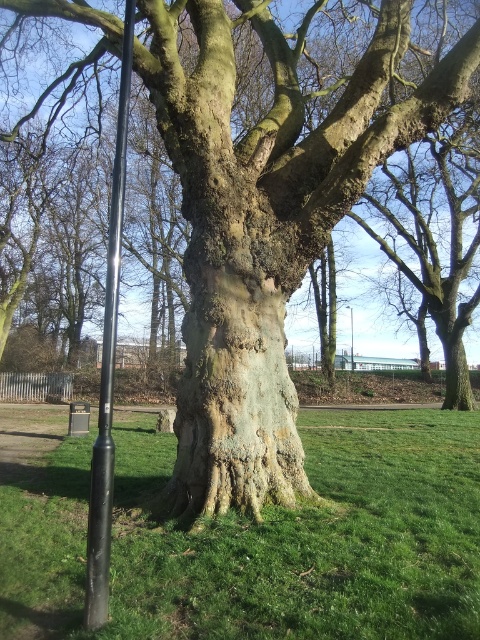
Question: Which of the following is the closest to the observer?

Choices:
 (A) (350, 355)
 (B) (98, 577)

Answer: (B)

Question: Which object is the farthest from the black metal pole at center?

Choices:
 (A) black matte pole at left
 (B) green grassy at center

Answer: (A)

Question: Is black matte pole at left positioned before black metal pole at center?

Choices:
 (A) yes
 (B) no

Answer: (A)

Question: Does green grassy at center appear under black metal pole at center?

Choices:
 (A) yes
 (B) no

Answer: (A)

Question: Which of the following is the farthest from the observer?

Choices:
 (A) green grassy at center
 (B) black metal pole at center
 (C) black matte pole at left

Answer: (B)

Question: Can you confirm if green grassy at center is bigger than black matte pole at left?

Choices:
 (A) yes
 (B) no

Answer: (B)